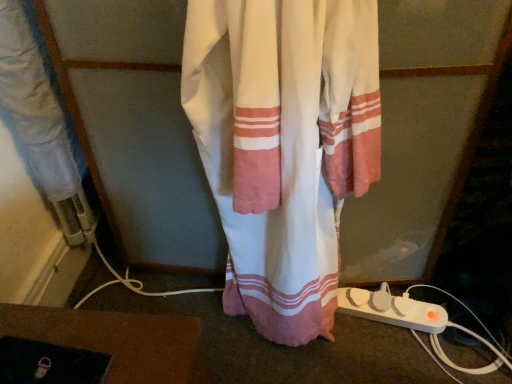
This screenshot has width=512, height=384. What do you see at coordinates (392, 309) in the screenshot? I see `white plastic extension cord at lower right` at bounding box center [392, 309].

Image resolution: width=512 pixels, height=384 pixels. Identify the location of white plastic extension cord at lower right. (392, 309).

What do you see at coordinates (284, 145) in the screenshot? I see `white cotton curtain at center` at bounding box center [284, 145].

The image size is (512, 384). In order to click on white cotton curtain at center in this screenshot , I will do `click(284, 145)`.

Locate an element on the screen. The width and height of the screenshot is (512, 384). white plastic extension cord at lower right is located at coordinates (392, 309).

Considering the positions of objects white cotton curtain at center and white plastic extension cord at lower right in the image provided, who is more to the right, white cotton curtain at center or white plastic extension cord at lower right?

Positioned to the right is white plastic extension cord at lower right.

Consider the image. Is white cotton curtain at center behind white plastic extension cord at lower right?

No, it is not.

Is point (365, 38) in front of point (362, 315)?

Yes.

From the image's perspective, is white cotton curtain at center above or below white plastic extension cord at lower right?

From the image's perspective, white cotton curtain at center appears above white plastic extension cord at lower right.

From a real-world perspective, which object stands above the other?

white cotton curtain at center, from a real-world perspective.

Looking at their sizes, would you say white cotton curtain at center is wider or thinner than white plastic extension cord at lower right?

In the image, white cotton curtain at center appears to be wider than white plastic extension cord at lower right.

Considering the relative sizes of white cotton curtain at center and white plastic extension cord at lower right in the image provided, is white cotton curtain at center taller than white plastic extension cord at lower right?

Yes, white cotton curtain at center is taller than white plastic extension cord at lower right.

Is white cotton curtain at center smaller than white plastic extension cord at lower right?

No.

Is white cotton curtain at center positioned beyond the bounds of white plastic extension cord at lower right?

Yes, white cotton curtain at center is located beyond the bounds of white plastic extension cord at lower right.

Based on the photo, is white cotton curtain at center in contact with white plastic extension cord at lower right?

No, white cotton curtain at center is not with white plastic extension cord at lower right.

Could you tell me if white cotton curtain at center is facing white plastic extension cord at lower right?

No, white cotton curtain at center does not turn towards white plastic extension cord at lower right.

Can you tell me how much white cotton curtain at center and white plastic extension cord at lower right differ in facing direction?

15.7 degrees separate the facing orientations of white cotton curtain at center and white plastic extension cord at lower right.

This screenshot has width=512, height=384. In order to click on curtain above the white plastic extension cord at lower right (from a real-world perspective) in this screenshot , I will do `click(284, 145)`.

Would you say white plastic extension cord at lower right is to the left or to the right of white cotton curtain at center in the picture?

Based on their positions, white plastic extension cord at lower right is located to the right of white cotton curtain at center.

In the image, is white plastic extension cord at lower right positioned in front of or behind white cotton curtain at center?

Visually, white plastic extension cord at lower right is located behind white cotton curtain at center.

Which is in front, point (349, 305) or point (223, 66)?

The point (223, 66) is in front.

From the image's perspective, is white plastic extension cord at lower right above white cotton curtain at center?

No, from the image's perspective, white plastic extension cord at lower right is not over white cotton curtain at center.

From a real-world perspective, is white plastic extension cord at lower right physically below white cotton curtain at center?

Yes, from a real-world perspective, white plastic extension cord at lower right is beneath white cotton curtain at center.

Considering the sizes of white plastic extension cord at lower right and white cotton curtain at center in the image, is white plastic extension cord at lower right wider or thinner than white cotton curtain at center?

white plastic extension cord at lower right is thinner than white cotton curtain at center.

Between white plastic extension cord at lower right and white cotton curtain at center, which one has more height?

With more height is white cotton curtain at center.

In the scene shown: Is white plastic extension cord at lower right bigger than white cotton curtain at center?

No, white plastic extension cord at lower right is not bigger than white cotton curtain at center.

Is white plastic extension cord at lower right inside the boundaries of white cotton curtain at center, or outside?

The correct answer is: outside.

Is white plastic extension cord at lower right not close to white cotton curtain at center?

white plastic extension cord at lower right is actually quite close to white cotton curtain at center.

Is white plastic extension cord at lower right turned away from white cotton curtain at center?

No.

Measure the distance between white plastic extension cord at lower right and white cotton curtain at center.

white plastic extension cord at lower right and white cotton curtain at center are 15.79 inches apart.

At what (x,y) coordinates should I click in order to perform the action: click on curtain in front of the white plastic extension cord at lower right. Please return your answer as a coordinate pair (x, y). Looking at the image, I should click on (284, 145).

Where is `curtain on the left of the white plastic extension cord at lower right`? This screenshot has width=512, height=384. curtain on the left of the white plastic extension cord at lower right is located at coordinates (284, 145).

Identify the location of curtain above the white plastic extension cord at lower right (from the image's perspective). (284, 145).